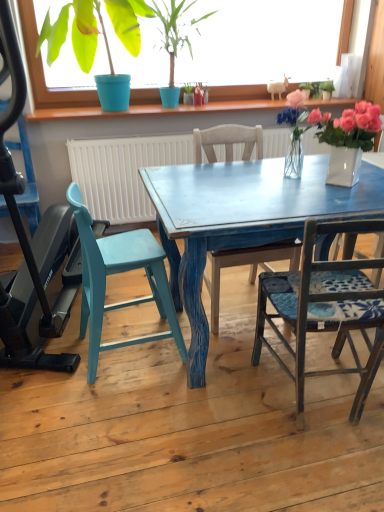
Question: From the image's perspective, is translucent glass vase at center located above or below teal painted wood chair at left, which is counted as the third chair, starting from the right?

Choices:
 (A) above
 (B) below

Answer: (A)

Question: Is translucent glass vase at center wider or thinner than teal painted wood chair at left, which is the 1th chair from left to right?

Choices:
 (A) thin
 (B) wide

Answer: (A)

Question: Estimate the real-world distances between objects in this image. Which object is closer to the wooden chair with blue patterned cushion at right, the 3th chair in the left-to-right sequence?

Choices:
 (A) green matte plant at upper center, the 1th houseplant viewed from the right
 (B) teal plastic baby carriage at left
 (C) green matte plant at upper left, the 1th houseplant from the left
 (D) translucent glass vase at center
 (E) wooden chair at center, which is counted as the 2th chair, starting from the right

Answer: (D)

Question: Estimate the real-world distances between objects in this image. Which object is farther from the wooden chair with blue patterned cushion at right, positioned as the first chair in right-to-left order?

Choices:
 (A) green matte plant at upper center, the 1th houseplant viewed from the right
 (B) translucent glass vase at center
 (C) wooden chair at center, which is the second chair in left-to-right order
 (D) teal plastic baby carriage at left
 (E) green matte plant at upper left, the 1th houseplant from the left

Answer: (E)